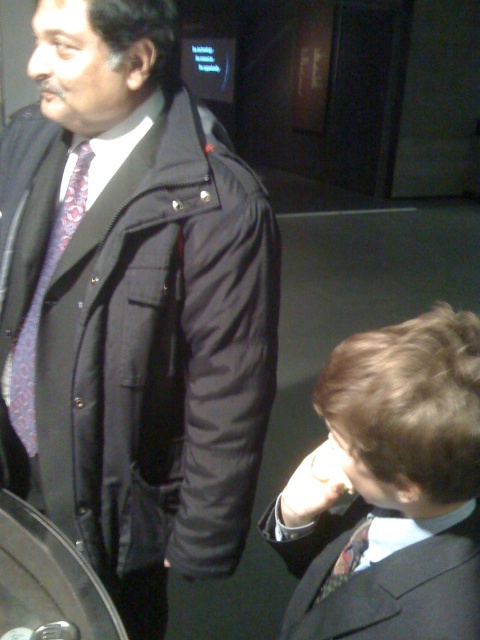
You are taking a photo of two people standing in a dimly lit room. The camera is positioned at a certain distance from the point labeled as point (412, 528). If the camera is 26.03 inches away from this point, will the two people be in focus if the camera has a depth of field that can cover 30 inches?

The point labeled (412, 528) is 26.03 inches away from the camera, which is within the camera depth of field of 30 inches. Therefore, the two people will be in focus.

You are organizing a formal event and need to ensure that the matte black suit at lower right and the matte floral tie at left are displayed properly. Which object should be placed on a wider display stand to accommodate its size?

The matte black suit at lower right should be placed on a wider display stand because it is wider than the matte floral tie at left.

You are a photographer positioned in front of the two people in the image. You want to take a clear photo of both the matte black suit at lower right and the matte floral tie at left. Which object should you focus on first to ensure both are in focus?

You should focus on the matte black suit at lower right first because it is closer to the viewer than the matte floral tie at left, allowing the depth of field to include both in focus when focusing on the closer object.